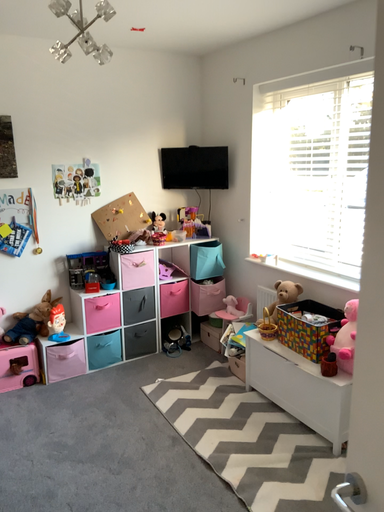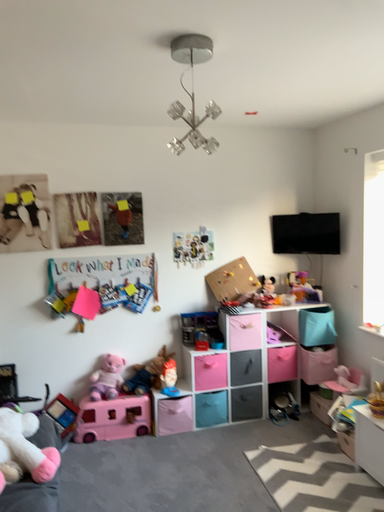
Question: How did the camera likely rotate when shooting the video?

Choices:
 (A) rotated left
 (B) rotated right

Answer: (A)